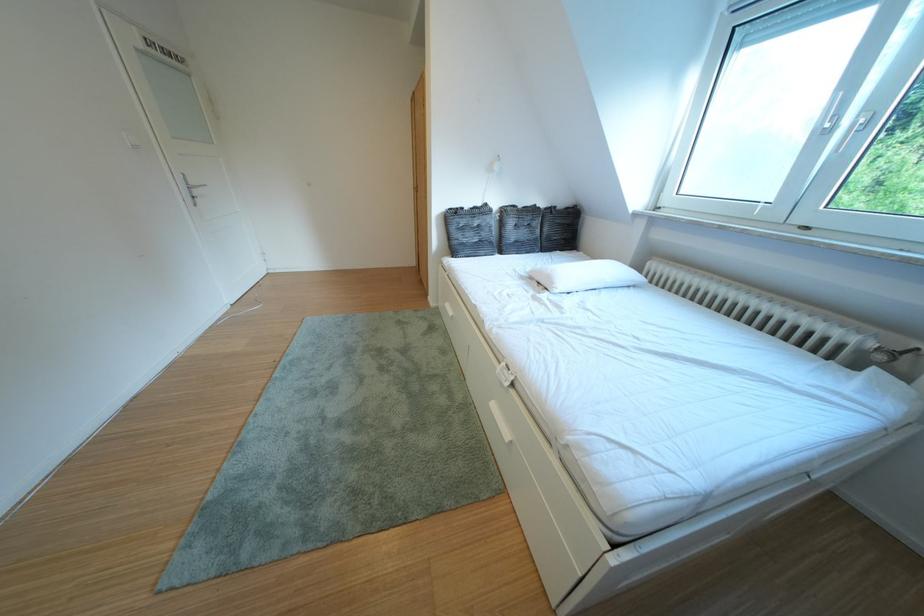
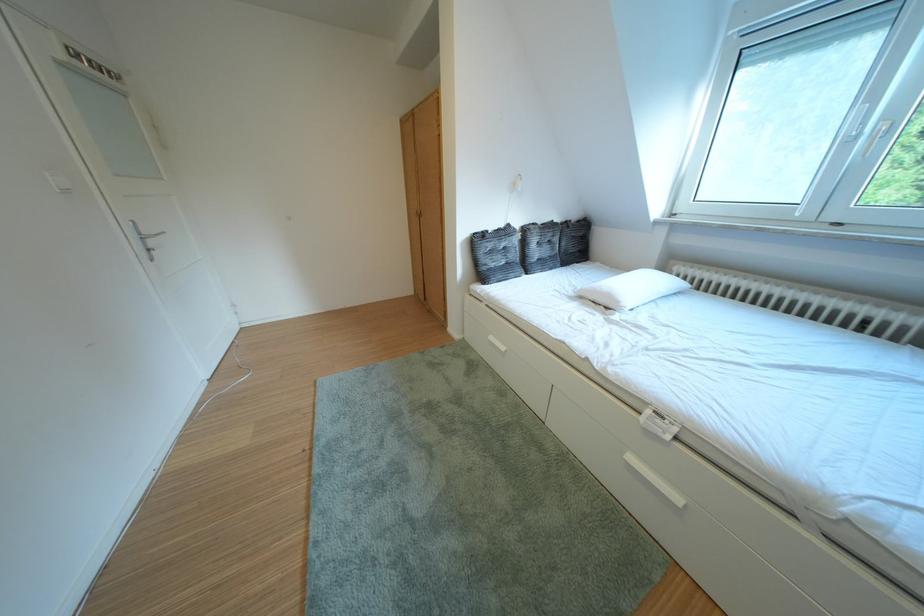
Locate, in the second image, the point that corresponds to [563,283] in the first image.

(623, 301)